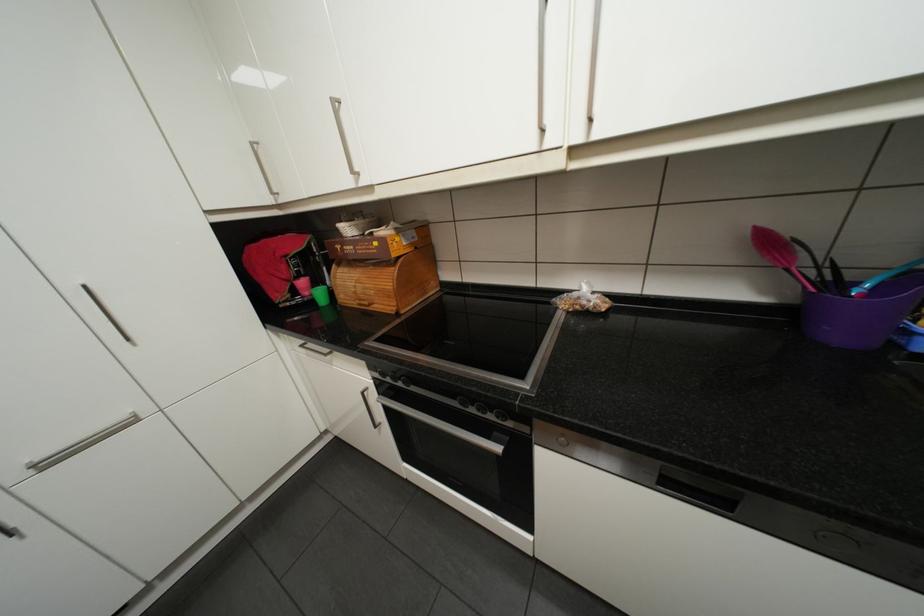
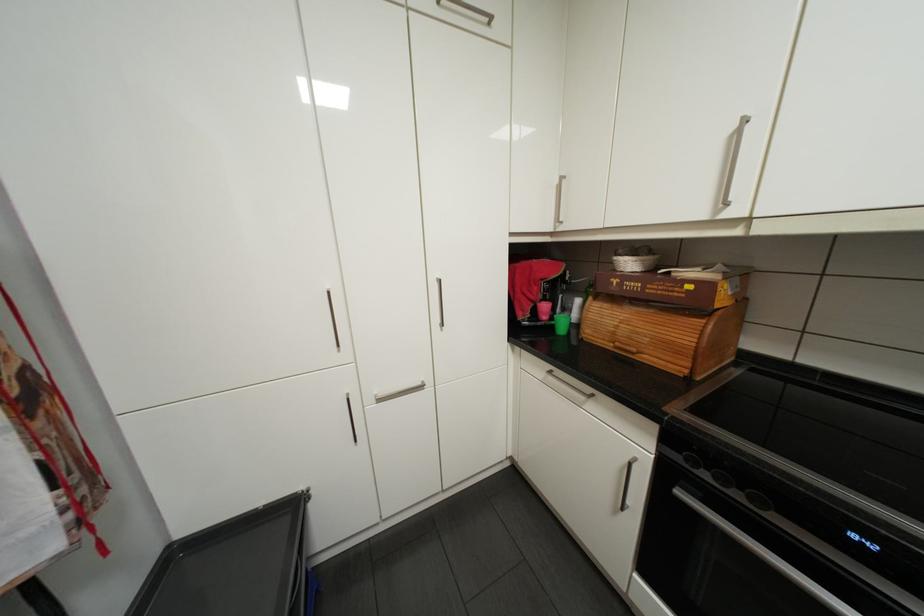
In the second image, find the point that corresponds to the point at 387,374 in the first image.

(695, 459)